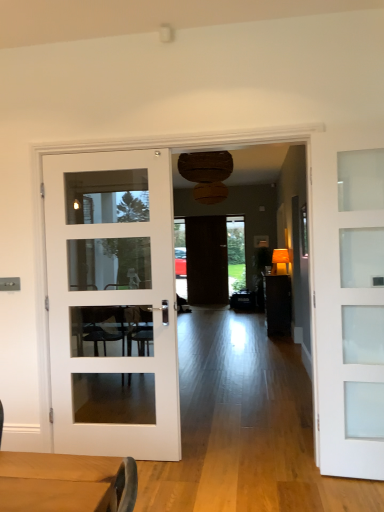
Question: Is dark wood door at center, which is the 1th door in back-to-front order, inside white glass door at left, acting as the 1th door starting from the left?

Choices:
 (A) no
 (B) yes

Answer: (A)

Question: From the image's perspective, is white glass door at left, the 2th door positioned from the front, located beneath dark wood door at center, the 2th door from the left?

Choices:
 (A) no
 (B) yes

Answer: (B)

Question: From a real-world perspective, is white glass door at left, the 2th door positioned from the front, positioned under dark wood door at center, which is the 1th door in back-to-front order, based on gravity?

Choices:
 (A) yes
 (B) no

Answer: (A)

Question: Is white glass door at left, arranged as the second door when viewed from the back, far away from dark wood door at center, the 3th door from the front?

Choices:
 (A) yes
 (B) no

Answer: (A)

Question: Is white glass door at left, the 3th door when ordered from right to left, not within dark wood door at center, which appears as the second door when viewed from the right?

Choices:
 (A) yes
 (B) no

Answer: (A)

Question: Considering the positions of point (218, 232) and point (302, 224), is point (218, 232) closer or farther from the camera than point (302, 224)?

Choices:
 (A) farther
 (B) closer

Answer: (A)

Question: Based on their positions, is dark wood door at center, which appears as the second door when viewed from the right, located to the left or right of green glass window at right?

Choices:
 (A) right
 (B) left

Answer: (B)

Question: From a real-world perspective, is dark wood door at center, which is the 1th door in back-to-front order, physically located above or below green glass window at right?

Choices:
 (A) below
 (B) above

Answer: (A)

Question: In terms of size, does dark wood door at center, the 2th door from the left, appear bigger or smaller than green glass window at right?

Choices:
 (A) big
 (B) small

Answer: (A)

Question: Considering the positions of matte brown table at center and green glass window at right in the image, is matte brown table at center wider or thinner than green glass window at right?

Choices:
 (A) thin
 (B) wide

Answer: (B)

Question: Considering their positions, is matte brown table at center located in front of or behind green glass window at right?

Choices:
 (A) behind
 (B) front

Answer: (A)

Question: Is matte brown table at center inside the boundaries of green glass window at right, or outside?

Choices:
 (A) outside
 (B) inside

Answer: (A)

Question: Looking at the image, does matte brown table at center seem bigger or smaller compared to green glass window at right?

Choices:
 (A) big
 (B) small

Answer: (A)

Question: Based on their sizes in the image, would you say matte brown table at center is bigger or smaller than dark wood door at center, the 3th door from the front?

Choices:
 (A) small
 (B) big

Answer: (B)

Question: In terms of height, does matte brown table at center look taller or shorter compared to dark wood door at center, the 3th door from the front?

Choices:
 (A) tall
 (B) short

Answer: (B)